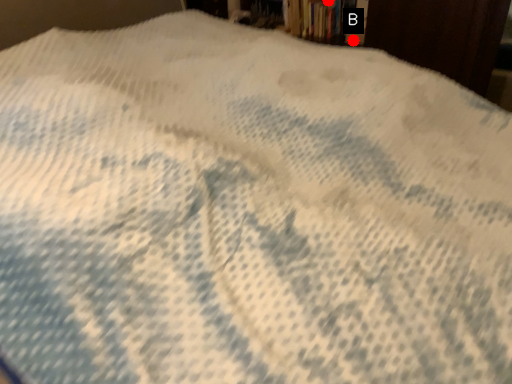
Question: Two points are circled on the image, labeled by A and B beside each circle. Among these points, which one is farthest from the camera?

Choices:
 (A) A is further
 (B) B is further

Answer: (A)